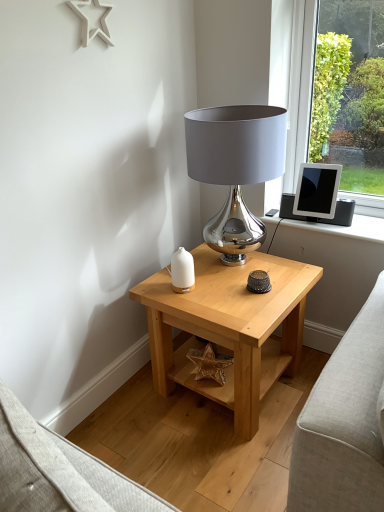
You are a GUI agent. You are given a task and a screenshot of the screen. Output one action in this format:
    pyautogui.click(x=<x>, y=<y>)
    Task: Click on the blank space situated above natural wood side table at center (from a real-world perspective)
    
    Given the screenshot: What is the action you would take?
    pyautogui.click(x=232, y=286)